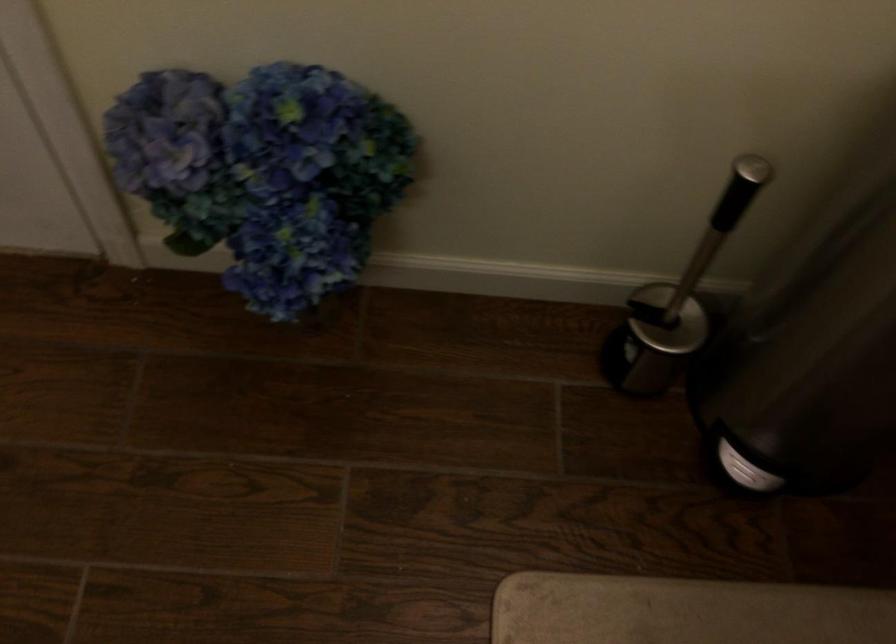
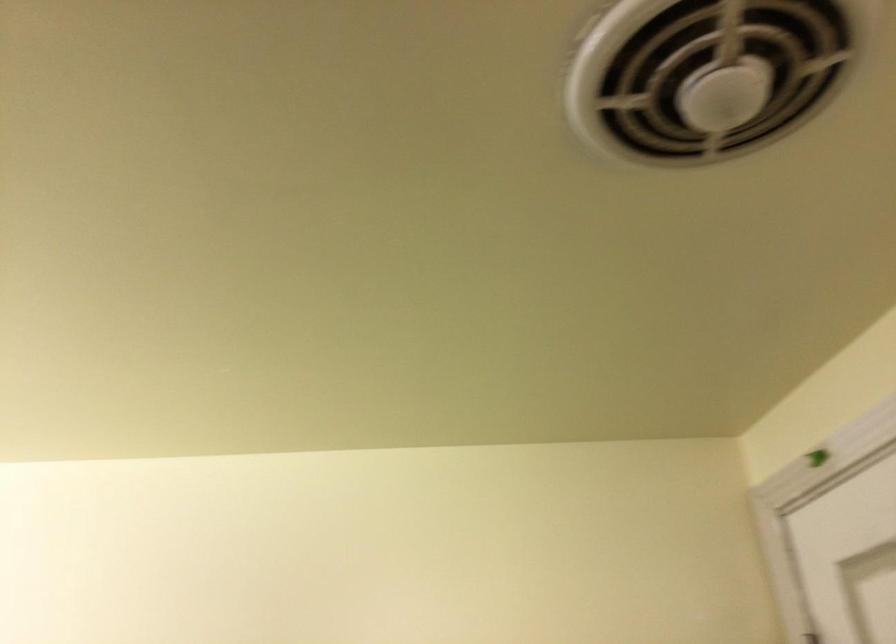
In the scene shown: First-person continuous shooting, in which direction is the camera rotating?

The rotation direction of the camera is left-up.